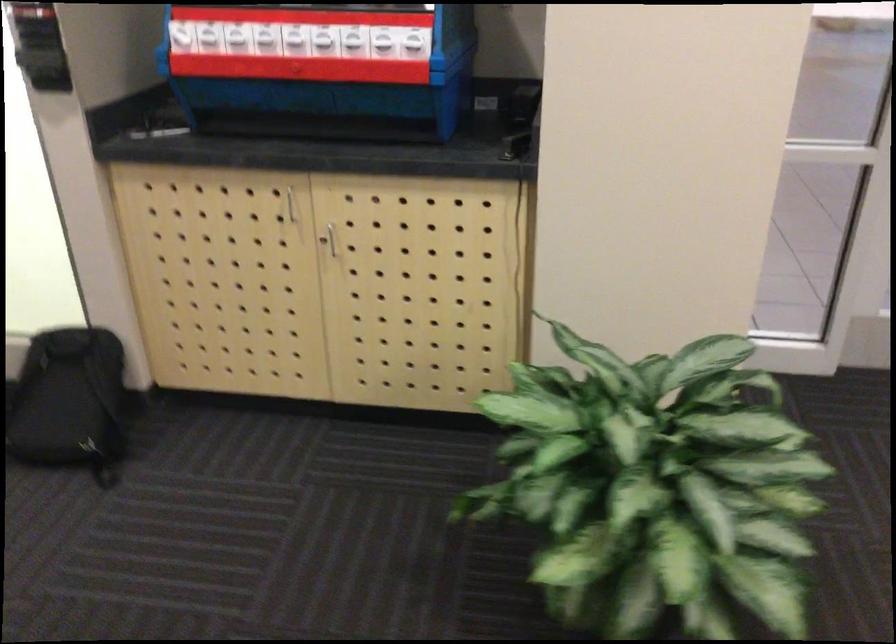
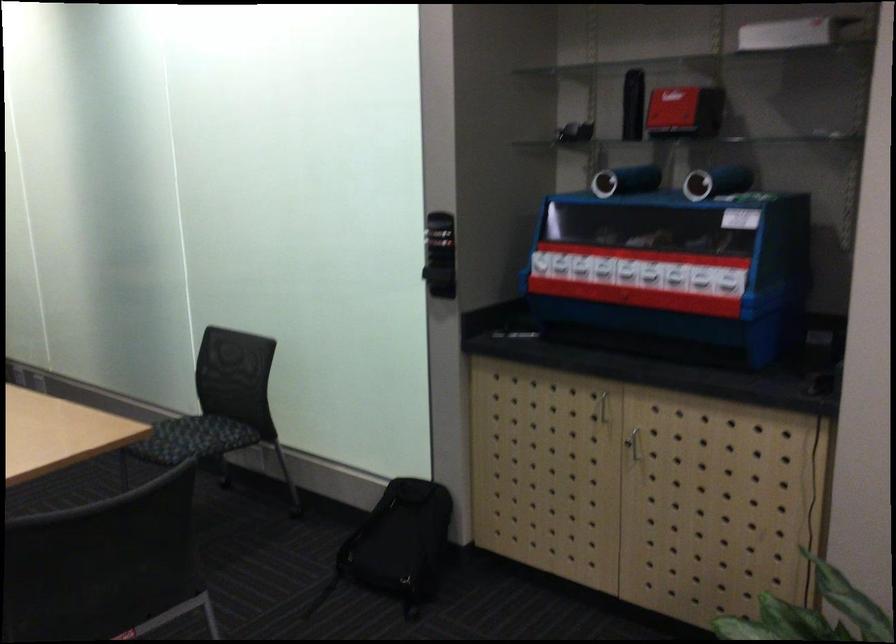
Where in the second image is the point corresponding to [321,243] from the first image?

(633, 442)